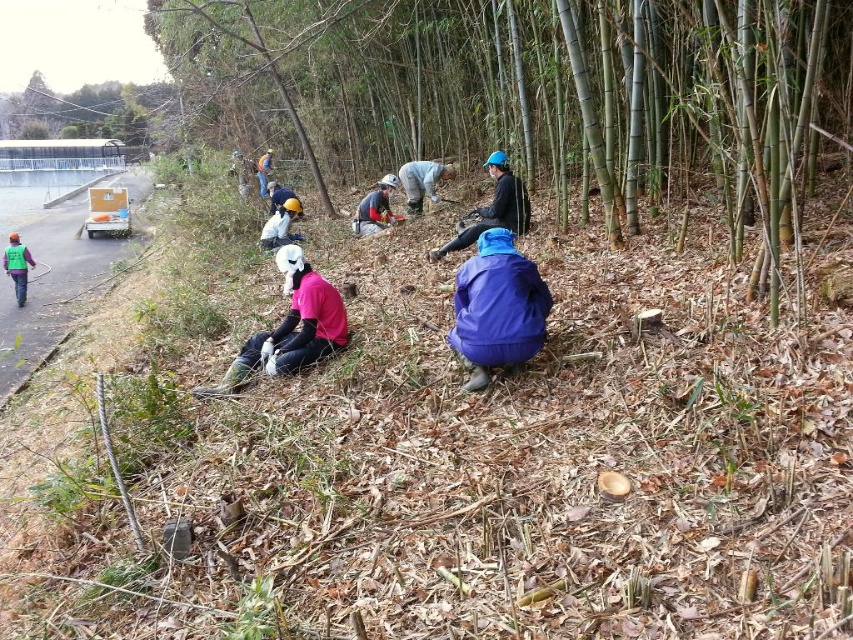
Consider the image. Who is positioned more to the right, white plastic bag at center or matte green vest at left?

From the viewer's perspective, white plastic bag at center appears more on the right side.

Is point (270, 225) farther from camera compared to point (16, 294)?

No, it is not.

Consider the image. Who is more forward, (260, 243) or (24, 300)?

Point (260, 243) is more forward.

Locate an element on the screen. The height and width of the screenshot is (640, 853). white plastic bag at center is located at coordinates (280, 225).

Is blue matte jacket at center shorter than white plastic bag at center?

In fact, blue matte jacket at center may be taller than white plastic bag at center.

This screenshot has width=853, height=640. I want to click on blue matte jacket at center, so click(497, 307).

Can you confirm if green bamboo at center is smaller than pink matte shirt at center?

Incorrect, green bamboo at center is not smaller in size than pink matte shirt at center.

What do you see at coordinates (549, 92) in the screenshot? I see `green bamboo at center` at bounding box center [549, 92].

Is point (735, 113) more distant than point (238, 362)?

That is False.

You are a GUI agent. You are given a task and a screenshot of the screen. Output one action in this format:
    pyautogui.click(x=<x>, y=<y>)
    Task: Click on the green bamboo at center
    This screenshot has width=853, height=640.
    Given the screenshot: What is the action you would take?
    pyautogui.click(x=549, y=92)